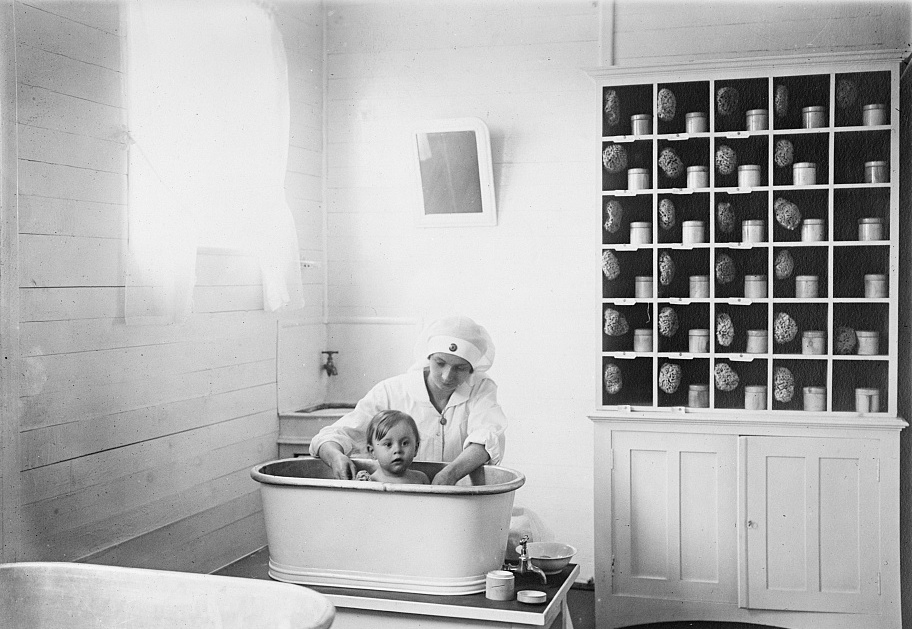
Where is `window`? window is located at coordinates (225, 130).